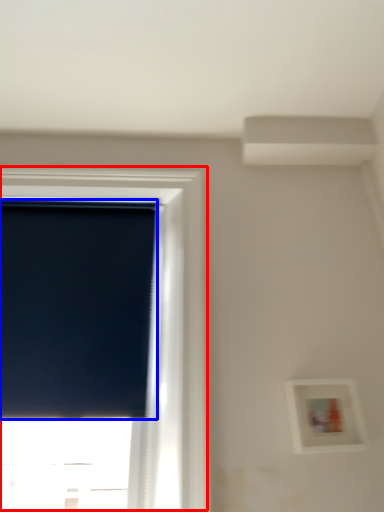
Question: Among these objects, which one is nearest to the camera, window (highlighted by a red box) or window screen (highlighted by a blue box)?

Choices:
 (A) window
 (B) window screen

Answer: (A)